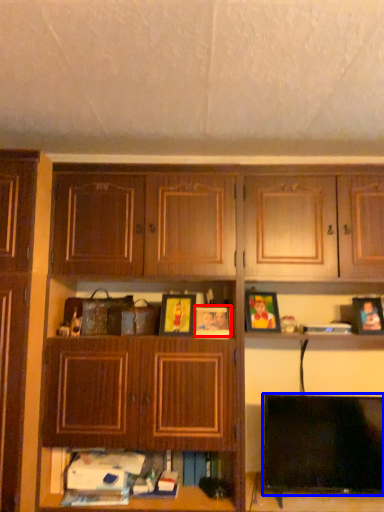
Question: Which of the following is the farthest to the observer, picture frame (highlighted by a red box) or television (highlighted by a blue box)?

Choices:
 (A) picture frame
 (B) television

Answer: (A)